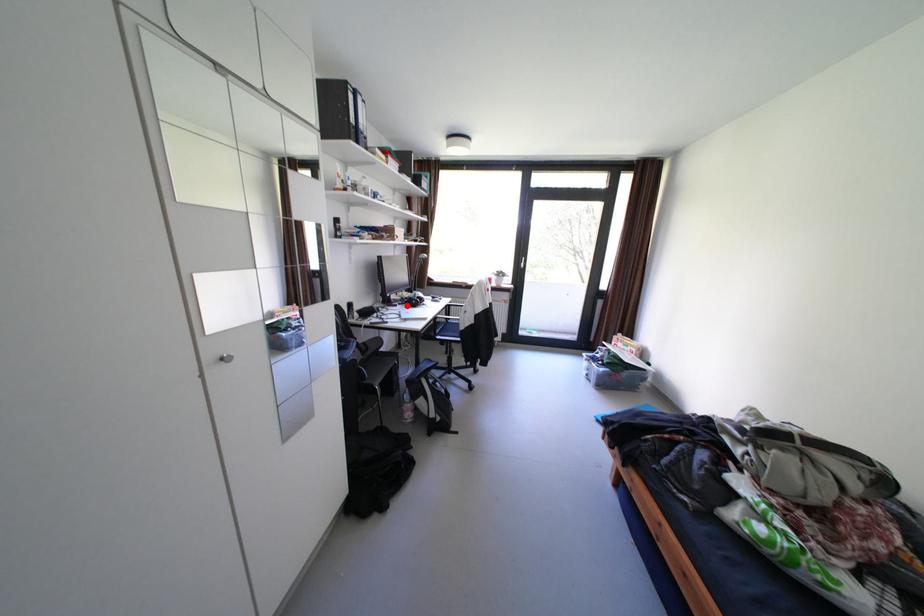
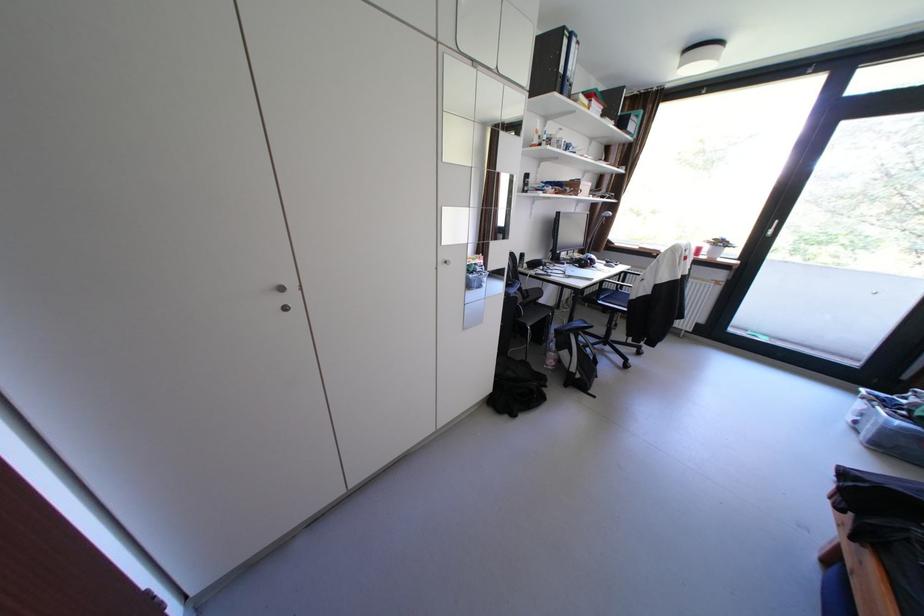
In the second image, find the point that corresponds to the highlighted location in the first image.

(574, 264)